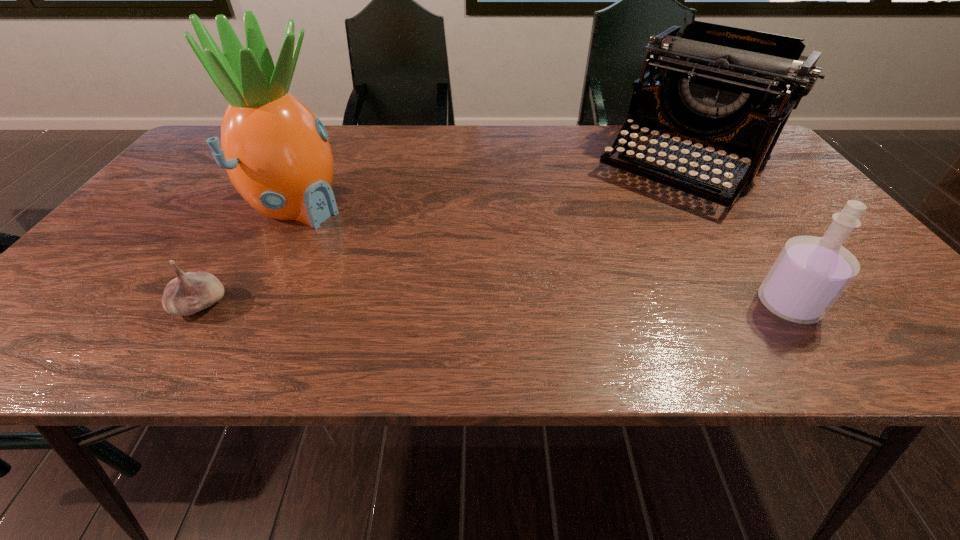
Locate an element on the screen. This screenshot has height=540, width=960. garlic is located at coordinates (x=191, y=292).

Identify the location of perfume. The width and height of the screenshot is (960, 540). (809, 275).

Image resolution: width=960 pixels, height=540 pixels. Find the location of `the tallest object`. the tallest object is located at coordinates click(x=276, y=152).

Where is `typewriter`? typewriter is located at coordinates (730, 90).

At what (x,y) coordinates should I click in order to perform the action: click on vacant region located 0.170m on the back of the shortest object. Please return your answer as a coordinate pair (x, y). The width and height of the screenshot is (960, 540). Looking at the image, I should click on (244, 235).

What are the coordinates of `blank area located 0.240m on the back of the second shortest object` in the screenshot? It's located at (727, 214).

The image size is (960, 540). I want to click on free space located 0.240m at the entrance of the tallest object, so 416,256.

Locate an element on the screen. Image resolution: width=960 pixels, height=540 pixels. vacant area situated 0.060m at the entrance of the tallest object is located at coordinates (352, 231).

Image resolution: width=960 pixels, height=540 pixels. What are the coordinates of `vacant space located 0.400m at the entrance of the tallest object` in the screenshot? It's located at (479, 283).

Image resolution: width=960 pixels, height=540 pixels. Identify the location of free location located on the typing side of the typewriter. (591, 268).